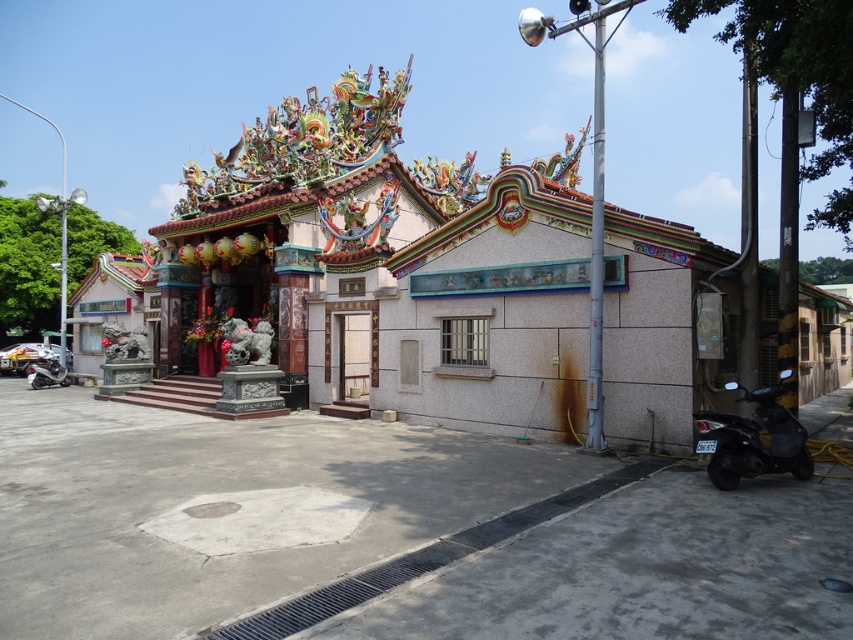
Is white stone door at center bigger than shiny silver motorcycle at lower left?

Incorrect, white stone door at center is not larger than shiny silver motorcycle at lower left.

Is point (370, 346) more distant than point (54, 378)?

No, (370, 346) is closer to viewer.

Where is `white stone door at center`? The image size is (853, 640). white stone door at center is located at coordinates (355, 353).

Between black matte motorcycle at lower right and white stone door at center, which one appears on the right side from the viewer's perspective?

black matte motorcycle at lower right is more to the right.

Does black matte motorcycle at lower right come in front of white stone door at center?

Yes.

Is point (738, 397) positioned before point (344, 346)?

Yes, it is in front of point (344, 346).

The height and width of the screenshot is (640, 853). What are the coordinates of `black matte motorcycle at lower right` in the screenshot? It's located at (752, 438).

How distant is black matte motorcycle at lower right from shiny silver motorcycle at lower left?

29.14 meters

Does black matte motorcycle at lower right have a larger size compared to shiny silver motorcycle at lower left?

No.

Who is more forward, (711, 467) or (39, 369)?

Point (711, 467) is in front.

Locate an element on the screen. black matte motorcycle at lower right is located at coordinates (752, 438).